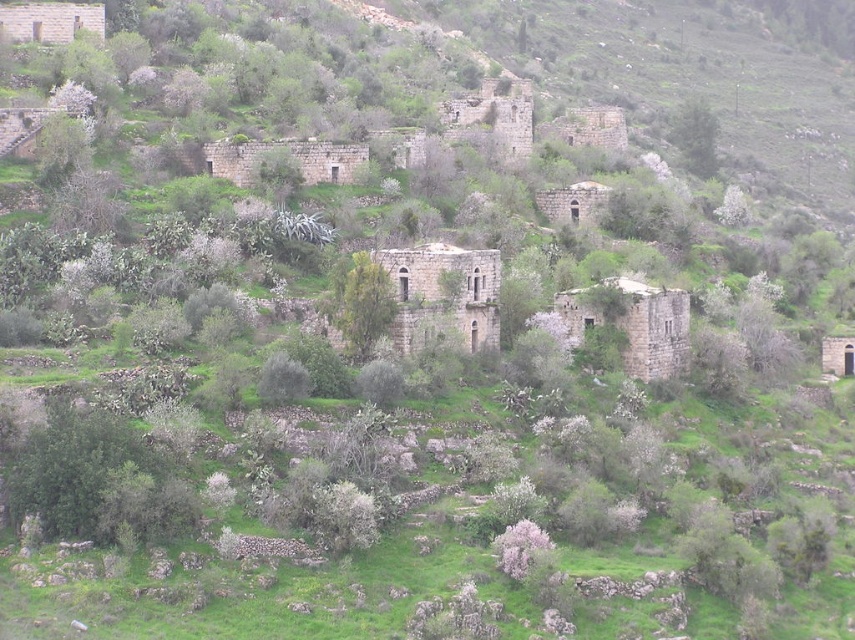
Is green leafy tree at center thinner than green leafy tree at upper right?

Correct, green leafy tree at center's width is less than green leafy tree at upper right's.

Does green leafy tree at center have a greater width compared to green leafy tree at upper right?

In fact, green leafy tree at center might be narrower than green leafy tree at upper right.

Find the location of a particular element. The width and height of the screenshot is (855, 640). green leafy tree at center is located at coordinates (361, 304).